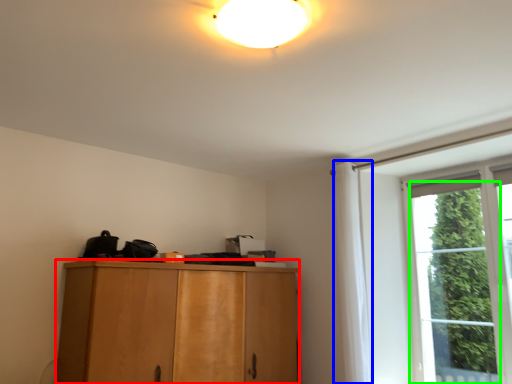
Question: Considering the real-world distances, which object is closest to cabinetry (highlighted by a red box)? curtain (highlighted by a blue box) or window (highlighted by a green box).

Choices:
 (A) curtain
 (B) window

Answer: (A)